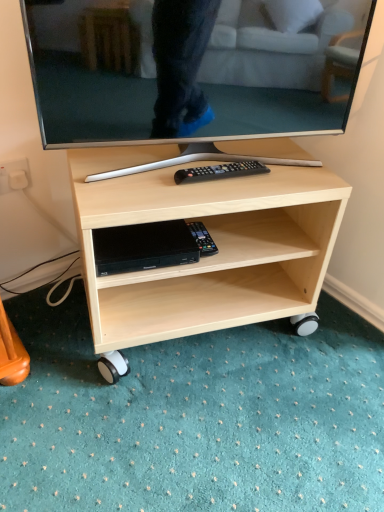
Where is `free spot in front of black plastic remote at center`? The height and width of the screenshot is (512, 384). free spot in front of black plastic remote at center is located at coordinates (219, 196).